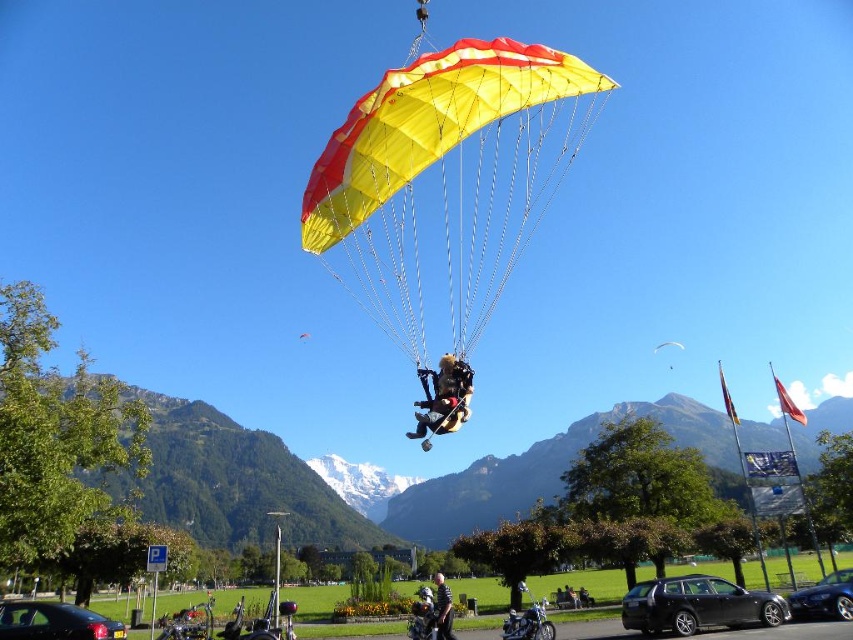
You are a photographer standing at the camera position. You want to capture a photo of the point at coordinates point [22,609]. Given that your camera has a maximum focus range of 30 meters, will you be able to focus on the point?

The point [22,609] is 35.34 meters away from the camera. Since the maximum focus range is 30 meters, the camera cannot focus on the point.

You are a photographer planning to capture the black glossy car at lower left and the matte black parachute at center in the same frame. Given their sizes, which object will appear bigger in the photo?

The black glossy car at lower left will appear bigger in the photo because it has a larger size compared to the matte black parachute at center.

You are a photographer trying to capture the paraglider in the sky. You notice two points in the image labeled as point (767, 620) and point (444, 381). Which point is closer to your camera lens?

Point (444, 381) is closer to the camera lens because it is less further away than point (767, 620).